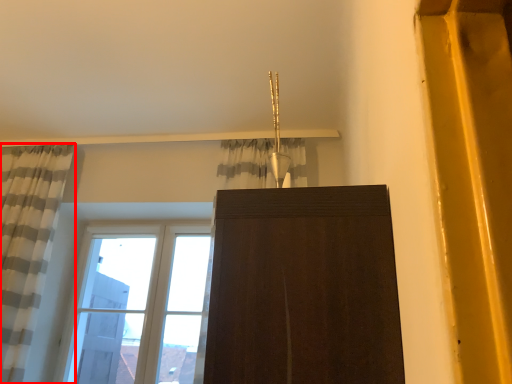
Question: Observing the image, what is the correct spatial positioning of curtain (annotated by the red box) in reference to window?

Choices:
 (A) right
 (B) left

Answer: (B)